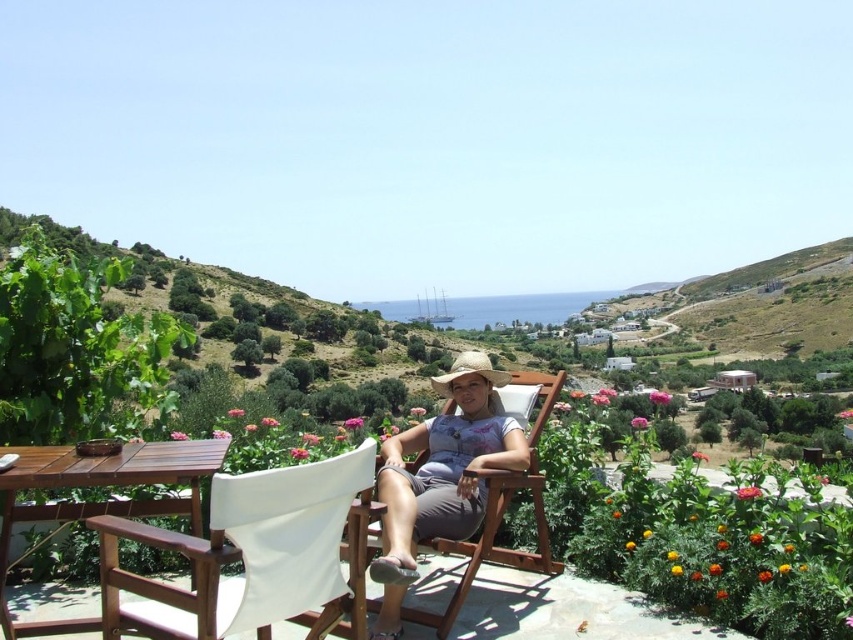
Based on the photo, you are standing at point (247, 554) in the image. What object is located exactly at this point?

The white canvas beach chair at lower center is located exactly at point (247, 554).